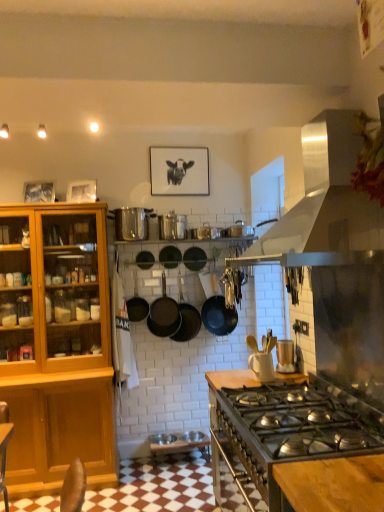
Question: Can you confirm if metallic silver toaster at upper right, which ranks as the 1th appliance in right-to-left order, is bigger than black matte wok at center, the second wok viewed from the left?

Choices:
 (A) yes
 (B) no

Answer: (B)

Question: Are metallic silver toaster at upper right, which ranks as the 1th appliance in right-to-left order, and black matte wok at center, the second wok viewed from the left, located far from each other?

Choices:
 (A) yes
 (B) no

Answer: (A)

Question: Is metallic silver toaster at upper right, the fourth appliance in the left-to-right sequence, oriented away from black matte wok at center, which is the first wok from right to left?

Choices:
 (A) no
 (B) yes

Answer: (A)

Question: Can you confirm if metallic silver toaster at upper right, which ranks as the 4th appliance in back-to-front order, is taller than black matte wok at center, which is the first wok from right to left?

Choices:
 (A) no
 (B) yes

Answer: (A)

Question: From a real-world perspective, does metallic silver toaster at upper right, arranged as the first appliance when ordered from the bottom, sit lower than black matte wok at center, which is the first wok from right to left?

Choices:
 (A) no
 (B) yes

Answer: (B)

Question: From the image's perspective, is metallic silver toaster at upper right, arranged as the first appliance when ordered from the bottom, on black matte wok at center, the second wok viewed from the left?

Choices:
 (A) yes
 (B) no

Answer: (B)

Question: Is matte black frying pan at center, positioned as the 2th frying pan in left-to-right order, looking in the opposite direction of metallic silver pot at center, which is the second appliance from top to bottom?

Choices:
 (A) yes
 (B) no

Answer: (B)

Question: From a real-world perspective, is matte black frying pan at center, placed as the second frying pan when sorted from right to left, on metallic silver pot at center, which is the second appliance from top to bottom?

Choices:
 (A) no
 (B) yes

Answer: (A)

Question: Is matte black frying pan at center, placed as the second frying pan when sorted from right to left, behind metallic silver pot at center, the third appliance from the bottom?

Choices:
 (A) yes
 (B) no

Answer: (A)

Question: From the image's perspective, does matte black frying pan at center, placed as the second frying pan when sorted from right to left, appear lower than metallic silver pot at center, which ranks as the 2th appliance in back-to-front order?

Choices:
 (A) no
 (B) yes

Answer: (B)

Question: Considering the relative sizes of matte black frying pan at center, positioned as the 2th frying pan in left-to-right order, and metallic silver pot at center, which is the second appliance in left-to-right order, in the image provided, is matte black frying pan at center, positioned as the 2th frying pan in left-to-right order, thinner than metallic silver pot at center, which is the second appliance in left-to-right order,?

Choices:
 (A) yes
 (B) no

Answer: (A)

Question: Is matte black frying pan at center, positioned as the 2th frying pan in left-to-right order, located outside metallic silver pot at center, the third appliance from the front?

Choices:
 (A) yes
 (B) no

Answer: (A)

Question: Does metallic silver pot at center, the third appliance from the bottom, have a lesser width compared to metallic silver toaster at upper right, arranged as the first appliance when ordered from the bottom?

Choices:
 (A) no
 (B) yes

Answer: (A)